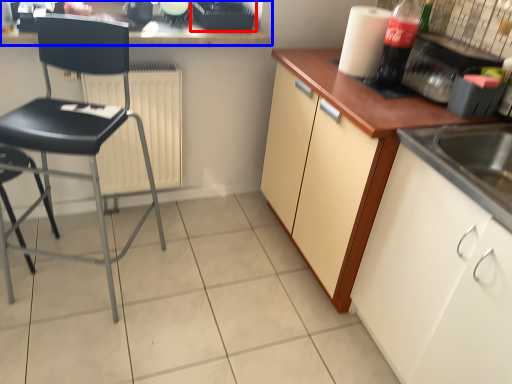
Question: Which object is further to the camera taking this photo, appliance (highlighted by a red box) or countertop (highlighted by a blue box)?

Choices:
 (A) appliance
 (B) countertop

Answer: (A)